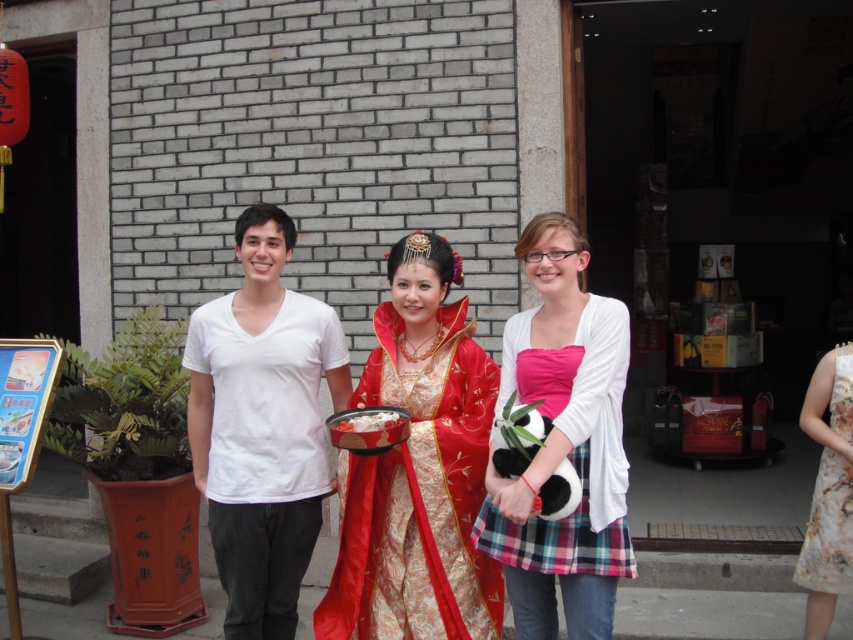
Between matte gold dress at center and white matte t-shirt at center, which one is positioned higher?

white matte t-shirt at center

Does point (437, 422) come behind point (241, 262)?

That is False.

Find the location of `matte gold dress at center`. matte gold dress at center is located at coordinates (418, 468).

Does matte gold dress at center have a smaller size compared to pink fabric dress at center?

Yes, matte gold dress at center is smaller than pink fabric dress at center.

This screenshot has width=853, height=640. I want to click on matte gold dress at center, so click(x=418, y=468).

Find the location of a particular element. The width and height of the screenshot is (853, 640). matte gold dress at center is located at coordinates (418, 468).

Is white matte t-shirt at center to the left of smooth glossy bowl at center from the viewer's perspective?

Yes, white matte t-shirt at center is to the left of smooth glossy bowl at center.

Looking at this image, can you confirm if white matte t-shirt at center is positioned below smooth glossy bowl at center?

Yes.

Between point (264, 342) and point (389, 419), which one is positioned in front?

Point (389, 419)

The image size is (853, 640). Find the location of `white matte t-shirt at center`. white matte t-shirt at center is located at coordinates (262, 426).